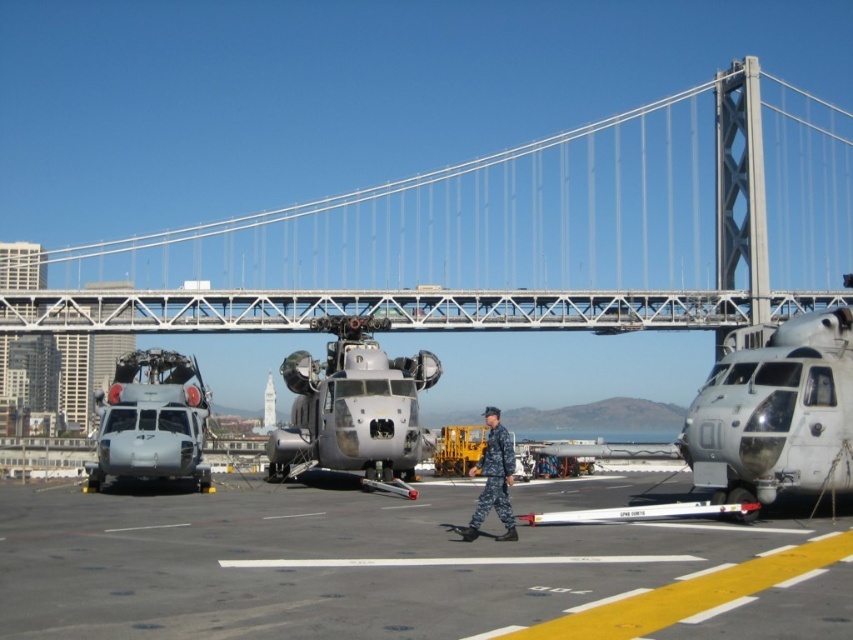
You are a military inspector standing at point (352, 404). You need to inspect the metallic gray helicopter at center. Is the helicopter located to your left, right, front, or back?

The metallic gray helicopter at center is located at the same point as you, so it is directly in front of you.

You are a drone operator tasked with flying a drone from the white metallic bridge at center to the metallic gray helicopter at right. The drone has a maximum range of 100 meters. Can the drone reach the helicopter?

The white metallic bridge at center is 110.67 meters from the metallic gray helicopter at right. Since the drone has a maximum range of 100 meters, it cannot reach the helicopter.